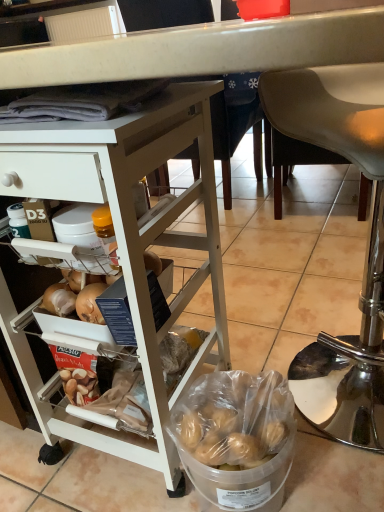
Question: Does clear plastic bucket at lower center have a lesser height compared to metallic silver chair at lower right?

Choices:
 (A) yes
 (B) no

Answer: (A)

Question: Is clear plastic bucket at lower center behind metallic silver chair at lower right?

Choices:
 (A) no
 (B) yes

Answer: (B)

Question: Is clear plastic bucket at lower center at the left side of metallic silver chair at lower right?

Choices:
 (A) no
 (B) yes

Answer: (B)

Question: Can you confirm if clear plastic bucket at lower center is positioned to the right of metallic silver chair at lower right?

Choices:
 (A) no
 (B) yes

Answer: (A)

Question: Does clear plastic bucket at lower center touch metallic silver chair at lower right?

Choices:
 (A) no
 (B) yes

Answer: (A)

Question: Does point (264, 93) appear closer or farther from the camera than point (210, 458)?

Choices:
 (A) closer
 (B) farther

Answer: (B)

Question: Considering the positions of metallic silver chair at lower right and clear plastic bucket at lower center in the image, is metallic silver chair at lower right taller or shorter than clear plastic bucket at lower center?

Choices:
 (A) tall
 (B) short

Answer: (A)

Question: Is metallic silver chair at lower right in front of or behind clear plastic bucket at lower center in the image?

Choices:
 (A) front
 (B) behind

Answer: (A)

Question: In the image, is metallic silver chair at lower right on the left side or the right side of clear plastic bucket at lower center?

Choices:
 (A) left
 (B) right

Answer: (B)

Question: Relative to metallic silver chair at lower right, is white matte desk at upper left in front or behind?

Choices:
 (A) front
 (B) behind

Answer: (A)

Question: Is white matte desk at upper left taller or shorter than metallic silver chair at lower right?

Choices:
 (A) tall
 (B) short

Answer: (A)

Question: Is white matte desk at upper left situated inside metallic silver chair at lower right or outside?

Choices:
 (A) inside
 (B) outside

Answer: (B)

Question: Considering the relative positions of white matte desk at upper left and metallic silver chair at lower right in the image provided, is white matte desk at upper left to the left or to the right of metallic silver chair at lower right?

Choices:
 (A) left
 (B) right

Answer: (A)

Question: In terms of size, does clear plastic bucket at lower center appear bigger or smaller than metallic silver chair at lower right?

Choices:
 (A) small
 (B) big

Answer: (A)

Question: Does point (278, 399) appear closer or farther from the camera than point (336, 403)?

Choices:
 (A) closer
 (B) farther

Answer: (A)